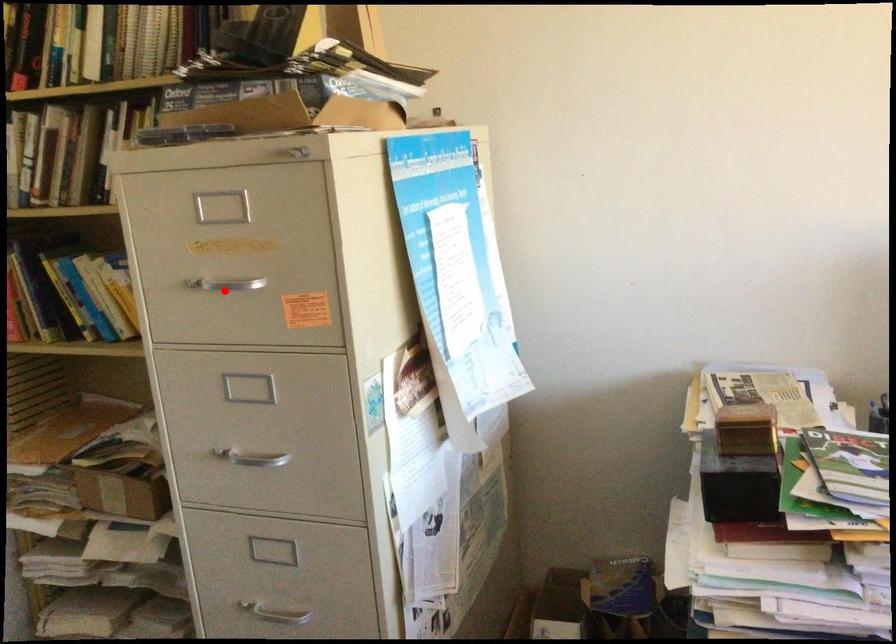
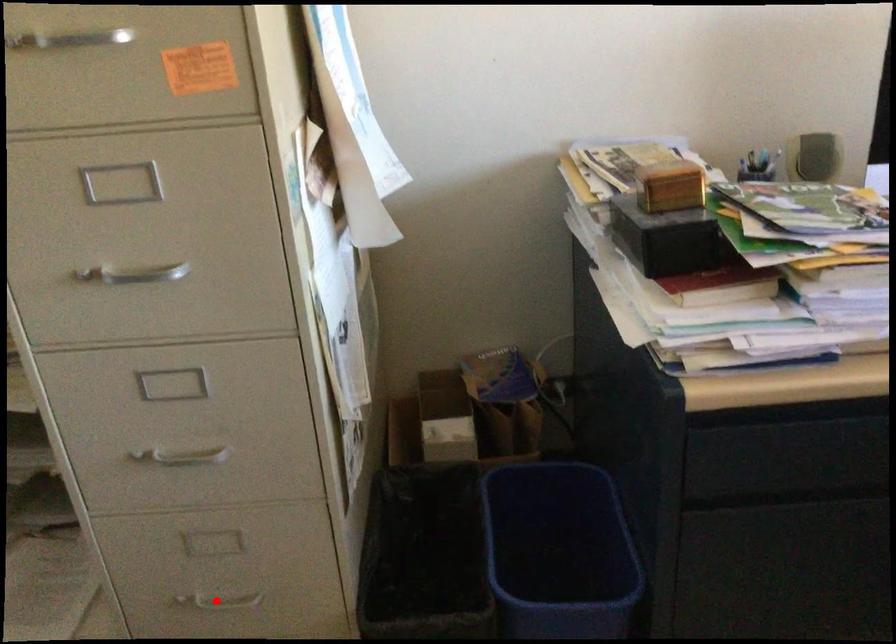
I am providing you with two images of the same scene from different viewpoints. A red point is marked on the first image and another point is marked on the second image. Are the points marked in image1 and image2 representing the same 3D position?

No